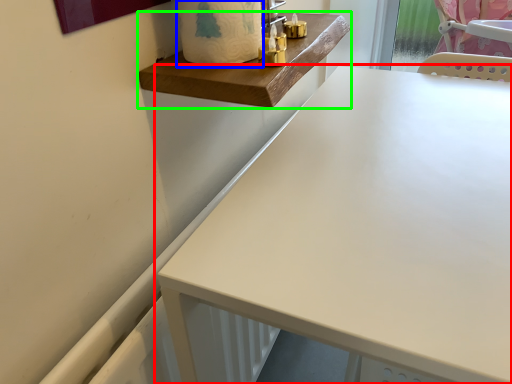
Question: Estimate the real-world distances between objects in this image. Which object is farther from table (highlighted by a red box), toilet paper (highlighted by a blue box) or changing table (highlighted by a green box)?

Choices:
 (A) toilet paper
 (B) changing table

Answer: (A)